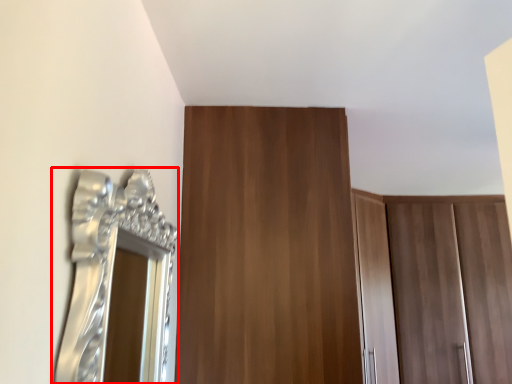
Question: In this image, where is mirror (annotated by the red box) located relative to door?

Choices:
 (A) right
 (B) left

Answer: (B)